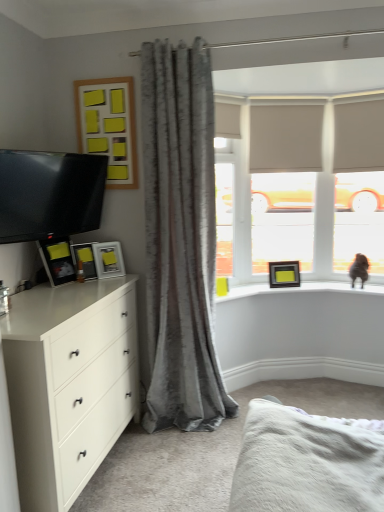
Question: From their relative heights in the image, would you say beige fabric blind at upper center is taller or shorter than beige fabric window frame at upper center?

Choices:
 (A) tall
 (B) short

Answer: (B)

Question: In terms of width, does beige fabric blind at upper center look wider or thinner when compared to beige fabric window frame at upper center?

Choices:
 (A) thin
 (B) wide

Answer: (A)

Question: Which of these objects is positioned closest to the transparent glass door at upper right?

Choices:
 (A) satin gray curtain at center
 (B) brown furry cat at upper right
 (C) matte black picture frame at upper right, the first picture frame in the bottom-to-top sequence
 (D) matte black tv at left
 (E) wooden frame with yellow sticky notes at upper left, acting as the fifth picture frame starting from the bottom

Answer: (B)

Question: Considering the real-world distances, which object is farthest from the matte black picture frame at left, which ranks as the fifth picture frame in back-to-front order?

Choices:
 (A) matte black picture frame at upper right, arranged as the 1th picture frame when viewed from the back
 (B) satin gray curtain at center
 (C) beige fabric blind at upper center
 (D) matte yellow picture frame at upper left, acting as the 2th picture frame starting from the back
 (E) transparent glass door at upper right

Answer: (E)